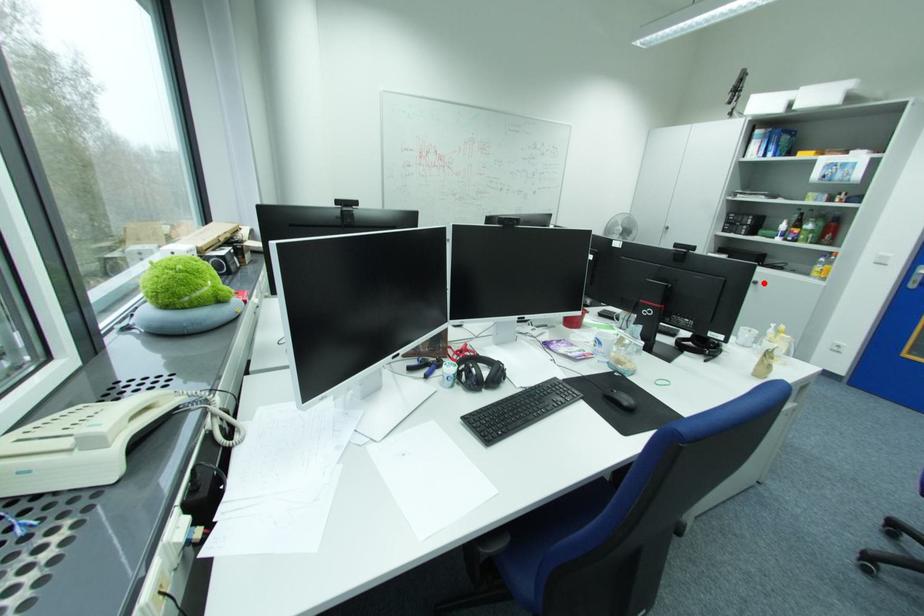
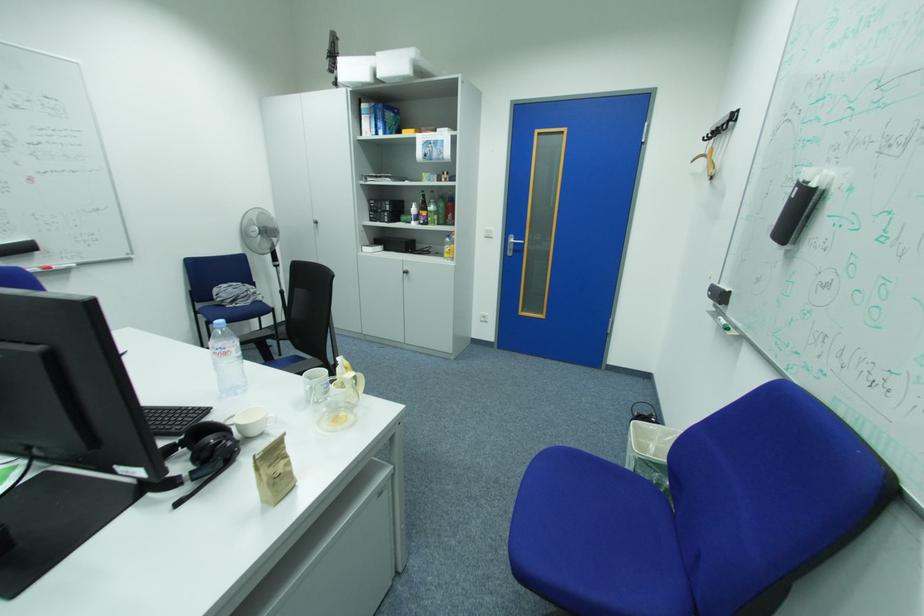
Find the pixel in the second image that matches the highlighted location in the first image.

(415, 273)